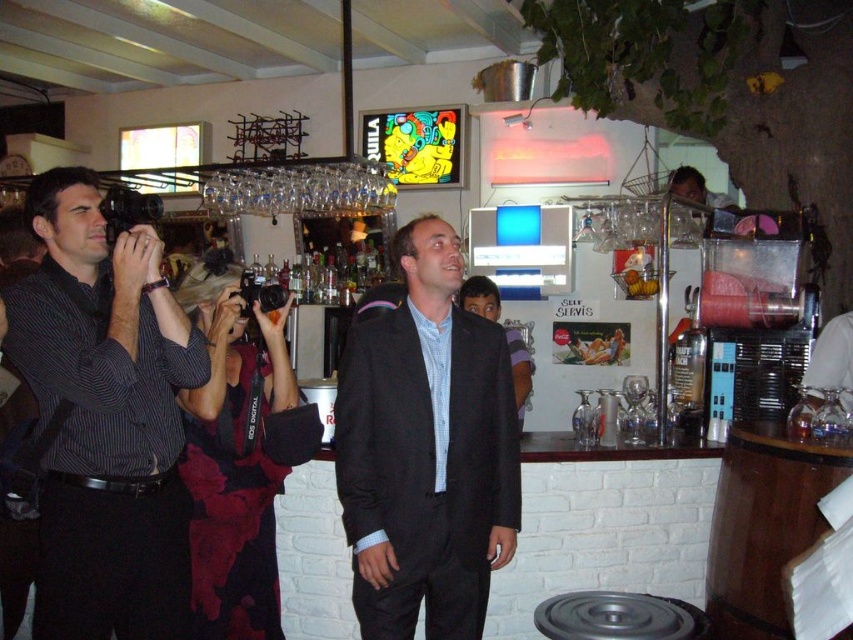
Between striped cotton shirt at left and black matte suit at center, which one has less height?

With less height is black matte suit at center.

Who is positioned more to the left, striped cotton shirt at left or black matte suit at center?

striped cotton shirt at left is more to the left.

Is point (173, 554) less distant than point (440, 259)?

Yes, it is.

Find the location of a particular element. The image size is (853, 640). striped cotton shirt at left is located at coordinates (105, 419).